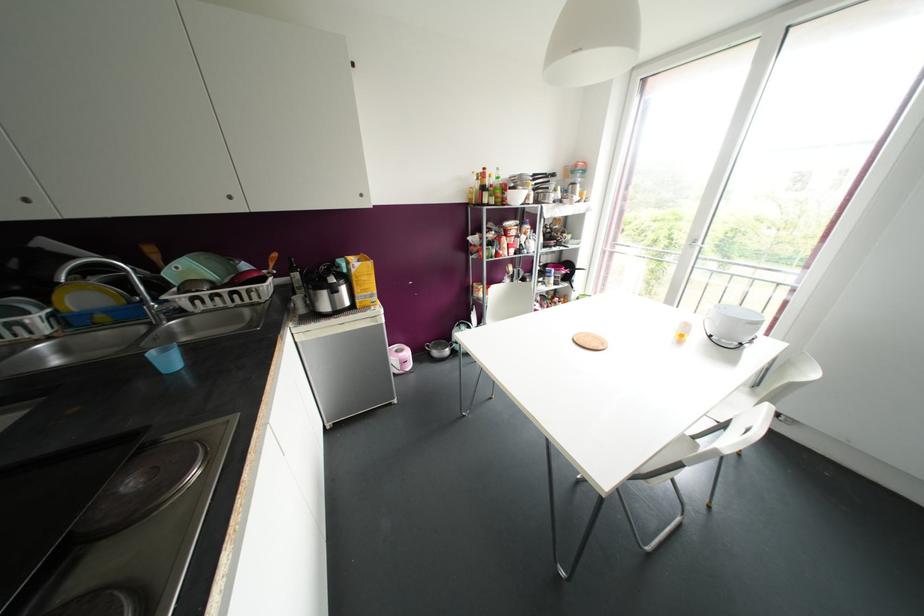
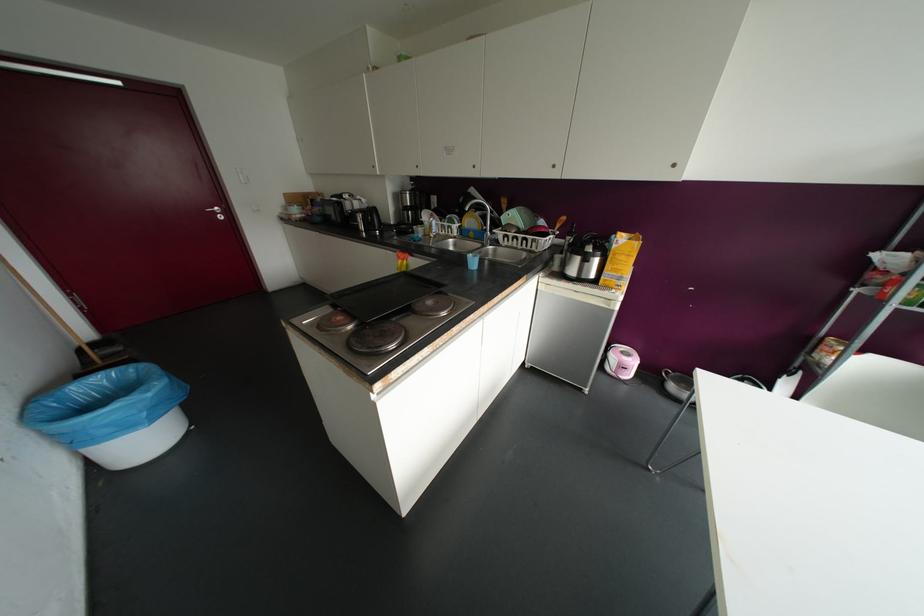
How did the camera likely rotate?

The rotation direction of the camera is left-down.